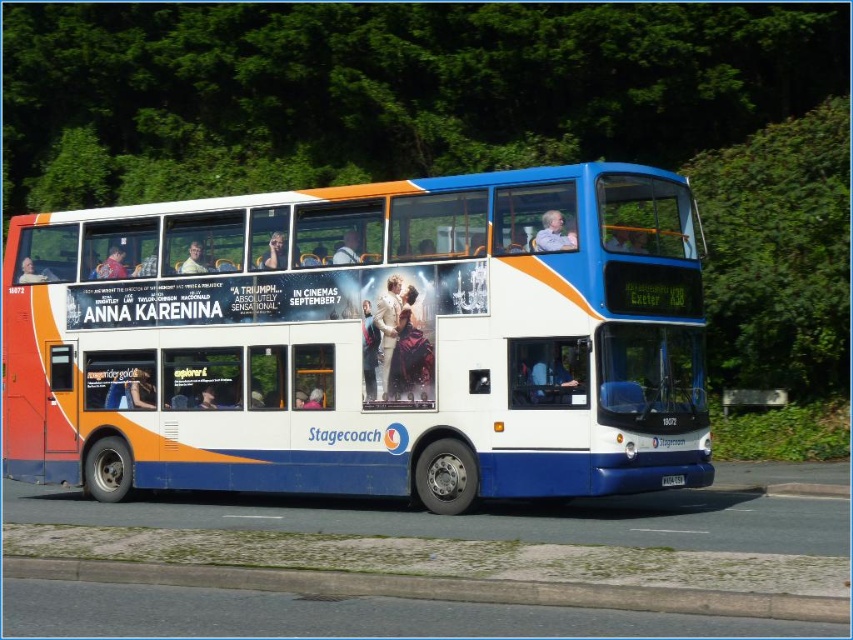
Question: Can you confirm if white glossy bus at center is thinner than white plastic license plate at center?

Choices:
 (A) yes
 (B) no

Answer: (B)

Question: Which point is farther to the camera?

Choices:
 (A) gray concrete curb at lower center
 (B) white plastic license plate at center

Answer: (B)

Question: Which point is farther to the camera?

Choices:
 (A) white glossy bus at center
 (B) white plastic license plate at center
 (C) gray concrete curb at lower center

Answer: (B)

Question: Does gray concrete curb at lower center have a larger size compared to white plastic license plate at center?

Choices:
 (A) yes
 (B) no

Answer: (A)

Question: Which object is the farthest from the gray concrete curb at lower center?

Choices:
 (A) white plastic license plate at center
 (B) white glossy bus at center

Answer: (B)

Question: Can you confirm if white glossy bus at center is wider than white plastic license plate at center?

Choices:
 (A) yes
 (B) no

Answer: (A)